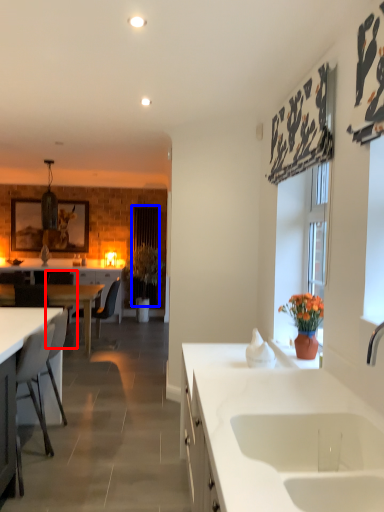
Question: Which object is further to the camera taking this photo, armchair (highlighted by a red box) or curtain (highlighted by a blue box)?

Choices:
 (A) armchair
 (B) curtain

Answer: (B)